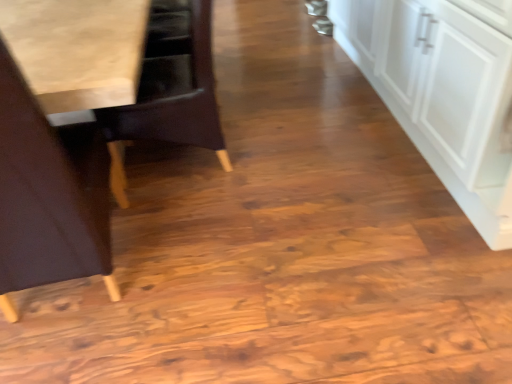
Locate an element on the screen. This screenshot has height=384, width=512. vacant area that is in front of wooden chair at left, which is the 2th chair from front to back is located at coordinates (197, 218).